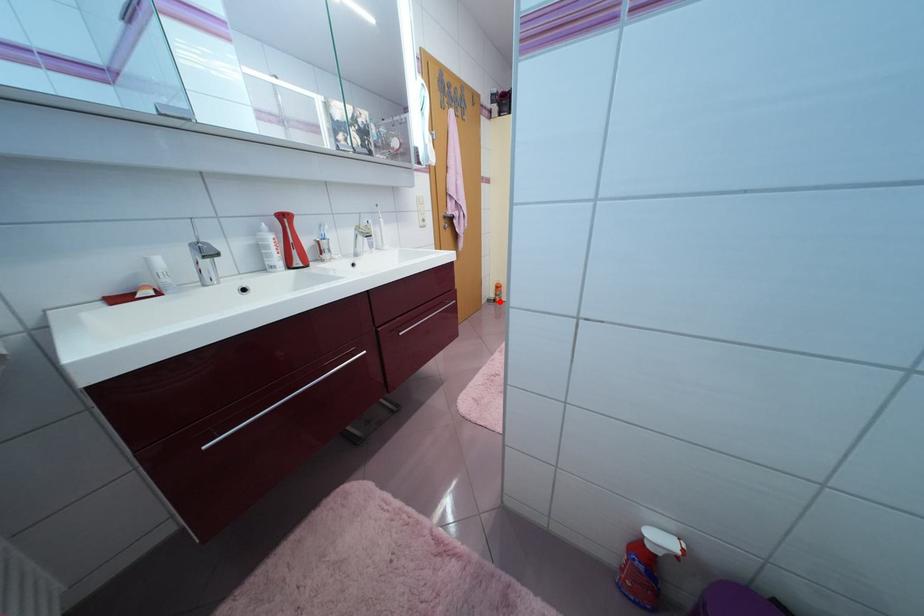
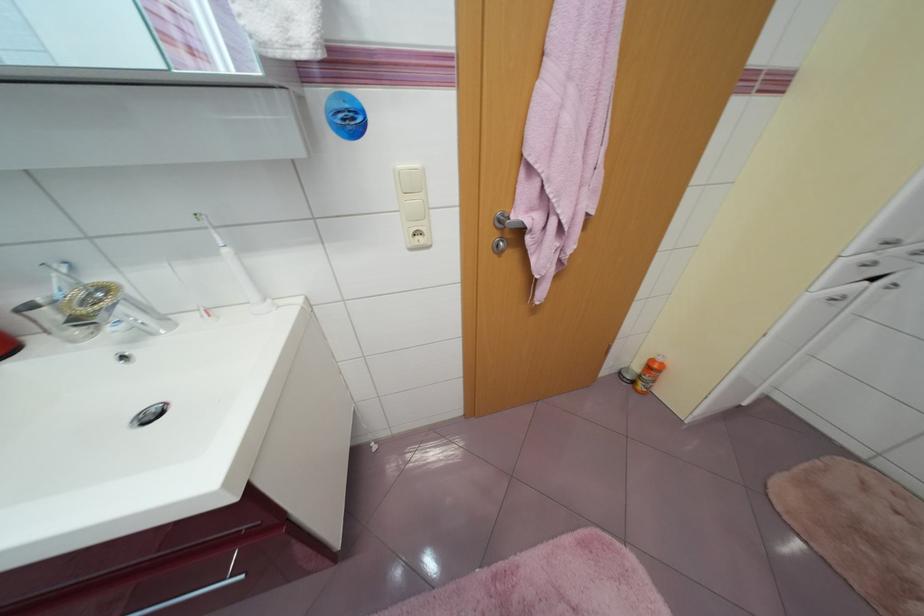
The point at the highlighted location is marked in the first image. Where is the corresponding point in the second image?

(638, 383)